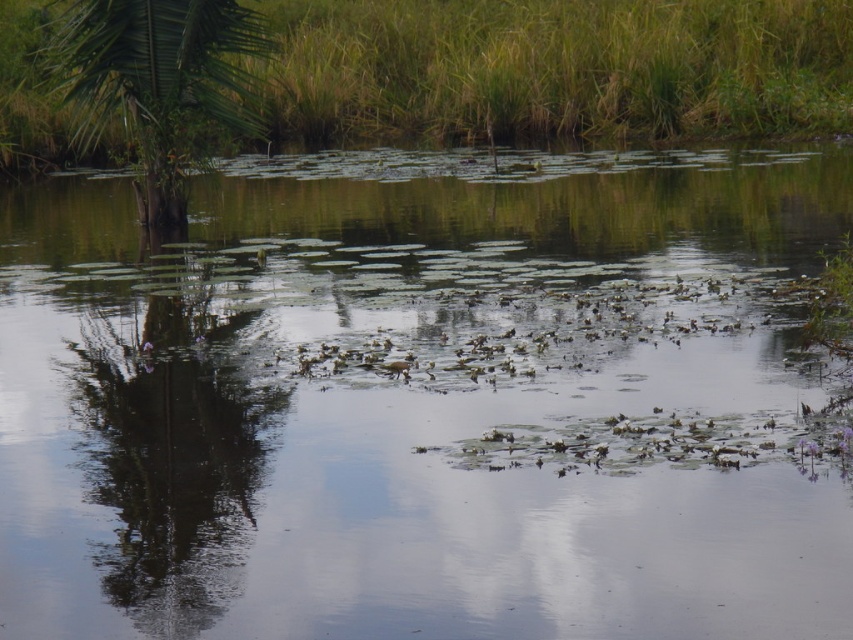
Question: Does green grass at upper center have a greater width compared to green leafy palm tree at left?

Choices:
 (A) yes
 (B) no

Answer: (A)

Question: Can you confirm if green grass at upper center is bigger than green leafy palm tree at left?

Choices:
 (A) no
 (B) yes

Answer: (B)

Question: Which point is farther to the camera?

Choices:
 (A) (79, 124)
 (B) (9, 72)

Answer: (B)

Question: Does green grass at upper center have a lesser width compared to green leafy palm tree at left?

Choices:
 (A) yes
 (B) no

Answer: (B)